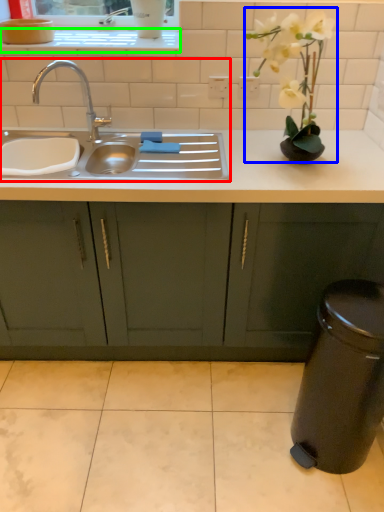
Question: Based on their relative distances, which object is nearer to sink (highlighted by a red box)? Choose from floral arrangement (highlighted by a blue box) and window sill (highlighted by a green box).

Choices:
 (A) floral arrangement
 (B) window sill

Answer: (B)